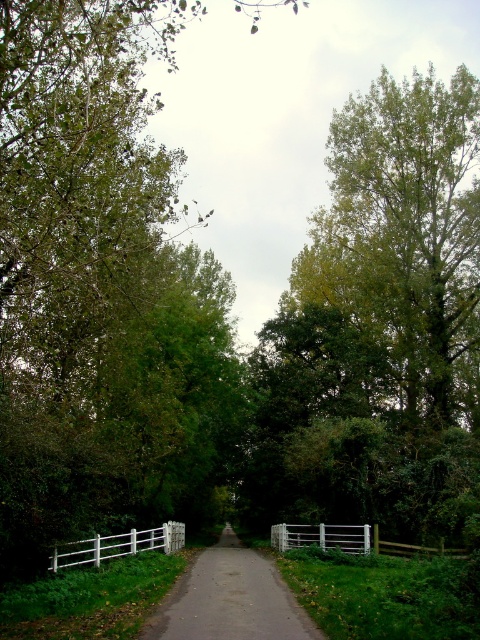
Who is positioned more to the right, smooth asphalt driveway at center or white wooden fence at center?

white wooden fence at center is more to the right.

The height and width of the screenshot is (640, 480). Identify the location of smooth asphalt driveway at center. (229, 600).

I want to click on smooth asphalt driveway at center, so click(x=229, y=600).

Consider the image. Is smooth asphalt driveway at center in front of white wooden fence at lower left?

That is True.

Is point (262, 568) positioned in front of point (109, 538)?

That is True.

What are the coordinates of `smooth asphalt driveway at center` in the screenshot? It's located at (229, 600).

Is white wooden fence at center bigger than white wooden fence at lower left?

Yes.

Which is in front, point (324, 529) or point (132, 534)?

Point (132, 534) is in front.

Between point (405, 547) and point (170, 524), which one is positioned in front?

Positioned in front is point (405, 547).

At what (x,y) coordinates should I click in order to perform the action: click on white wooden fence at center. Please return your answer as a coordinate pair (x, y). This screenshot has height=640, width=480. Looking at the image, I should click on (349, 540).